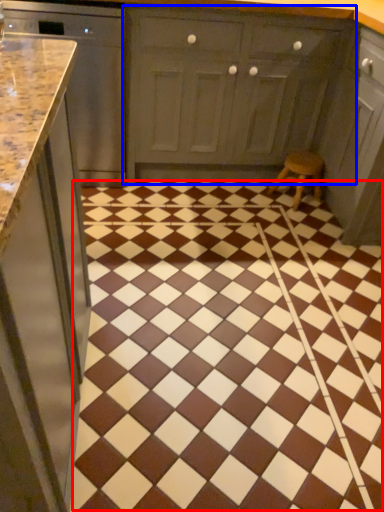
Question: Which object appears farthest to the camera in this image, ceramic tile (highlighted by a red box) or cabinetry (highlighted by a blue box)?

Choices:
 (A) ceramic tile
 (B) cabinetry

Answer: (B)